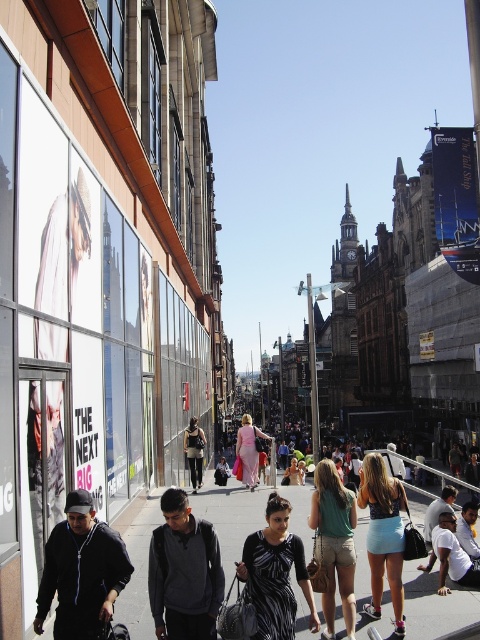
Question: Which is farther from the matte pink dress at center?

Choices:
 (A) smooth concrete pavement at center
 (B) white cotton shirt at lower right
 (C) black hoodie at lower left
 (D) light pink fabric dress at center

Answer: (C)

Question: Can you confirm if white cotton shirt at lower right is wider than matte pink dress at center?

Choices:
 (A) no
 (B) yes

Answer: (A)

Question: Based on their relative distances, which object is farther from the dark gray sweater at center?

Choices:
 (A) light pink fabric dress at center
 (B) matte pink dress at center
 (C) green cotton tank top at center

Answer: (A)

Question: Does black hoodie at lower left appear under matte black jacket at center?

Choices:
 (A) yes
 (B) no

Answer: (A)

Question: Which of the following is the closest to the observer?

Choices:
 (A) (203, 435)
 (B) (225, 464)

Answer: (A)

Question: Considering the relative positions of green cotton tank top at center and matte black jacket at center in the image provided, where is green cotton tank top at center located with respect to matte black jacket at center?

Choices:
 (A) left
 (B) right

Answer: (B)